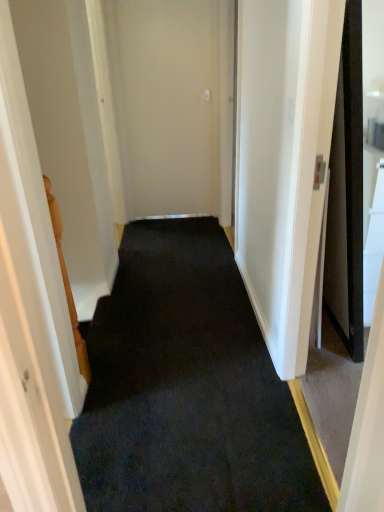
Question: Is beige matte door at center oriented away from black carpet at center?

Choices:
 (A) yes
 (B) no

Answer: (B)

Question: Is beige matte door at center oriented towards black carpet at center?

Choices:
 (A) yes
 (B) no

Answer: (A)

Question: Is beige matte door at center outside black carpet at center?

Choices:
 (A) yes
 (B) no

Answer: (A)

Question: From the image's perspective, is beige matte door at center on black carpet at center?

Choices:
 (A) no
 (B) yes

Answer: (B)

Question: Does beige matte door at center have a lesser height compared to black carpet at center?

Choices:
 (A) no
 (B) yes

Answer: (A)

Question: From the image's perspective, would you say beige matte door at center is shown under black carpet at center?

Choices:
 (A) no
 (B) yes

Answer: (A)

Question: Is black carpet at center not inside beige matte door at center?

Choices:
 (A) no
 (B) yes

Answer: (B)

Question: From the image's perspective, would you say black carpet at center is positioned over beige matte door at center?

Choices:
 (A) yes
 (B) no

Answer: (B)

Question: From a real-world perspective, is black carpet at center on beige matte door at center?

Choices:
 (A) no
 (B) yes

Answer: (A)

Question: Does black carpet at center have a greater width compared to beige matte door at center?

Choices:
 (A) no
 (B) yes

Answer: (B)

Question: Does black carpet at center have a smaller size compared to beige matte door at center?

Choices:
 (A) no
 (B) yes

Answer: (A)

Question: Is black carpet at center positioned before beige matte door at center?

Choices:
 (A) no
 (B) yes

Answer: (B)

Question: Do you think black carpet at center is within beige matte door at center, or outside of it?

Choices:
 (A) inside
 (B) outside

Answer: (B)